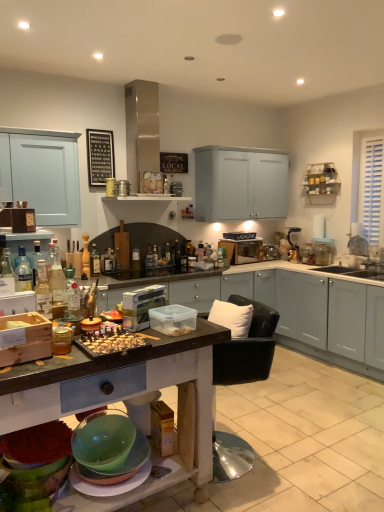
This screenshot has width=384, height=512. What do you see at coordinates (357, 270) in the screenshot? I see `white ceramic sink at right` at bounding box center [357, 270].

Image resolution: width=384 pixels, height=512 pixels. I want to click on white ceramic sink at right, so click(x=357, y=270).

Locate an element on the screen. metallic silver shelves at upper right is located at coordinates (321, 183).

What is the approximate height of white soft cushion at center?

white soft cushion at center is 10.41 inches tall.

This screenshot has height=512, width=384. I want to click on translucent glass bottle at center, which ranks as the 4th bottle in front-to-back order, so click(x=94, y=261).

Where is `clear glass bottle at left, arranged as the 2th bottle when viewed from the left`? clear glass bottle at left, arranged as the 2th bottle when viewed from the left is located at coordinates (36, 260).

Measure the distance between clear glass bottle at left, arranged as the 2th bottle when viewed from the left, and camera.

clear glass bottle at left, arranged as the 2th bottle when viewed from the left, is 7.21 feet from camera.

At what (x,y) coordinates should I click in order to perform the action: click on white plastic toaster at center, acting as the 1th appliance starting from the bottom. Please return your answer as a coordinate pair (x, y). This screenshot has width=384, height=512. Looking at the image, I should click on (141, 306).

How much space does white plastic toaster at center, acting as the 1th appliance starting from the bottom, occupy vertically?

The height of white plastic toaster at center, acting as the 1th appliance starting from the bottom, is 8.03 inches.

Find the location of a particular element. white ceramic sink at right is located at coordinates (357, 270).

From a real-world perspective, does white soft cushion at center sit lower than wooden signboard at upper left?

Yes, from a real-world perspective, white soft cushion at center is below wooden signboard at upper left.

In order to click on pillow directly beneath the wooden signboard at upper left (from a real-world perspective) in this screenshot , I will do `click(232, 317)`.

From a real-world perspective, is translucent glass bottle at center, which is the fifth bottle in left-to-right order, above or below clear glass bottle at center, the fifth bottle when ordered from back to front?

In terms of real-world spatial position, translucent glass bottle at center, which is the fifth bottle in left-to-right order, is below clear glass bottle at center, the fifth bottle when ordered from back to front.

Considering the relative positions of translucent glass bottle at center, which appears as the second bottle when viewed from the right, and clear glass bottle at center, marked as the second bottle in a front-to-back arrangement, in the image provided, is translucent glass bottle at center, which appears as the second bottle when viewed from the right, to the right of clear glass bottle at center, marked as the second bottle in a front-to-back arrangement, from the viewer's perspective?

Yes.

Considering the sizes of objects translucent glass bottle at center, which is the fifth bottle in left-to-right order, and clear glass bottle at center, positioned as the third bottle in right-to-left order, in the image provided, who is bigger, translucent glass bottle at center, which is the fifth bottle in left-to-right order, or clear glass bottle at center, positioned as the third bottle in right-to-left order,?

With larger size is translucent glass bottle at center, which is the fifth bottle in left-to-right order.

Considering the relative positions of translucent glass bottle at center, the 2th bottle from the back, and clear glass bottle at center, which ranks as the 4th bottle in left-to-right order, in the image provided, is translucent glass bottle at center, the 2th bottle from the back, in front of clear glass bottle at center, which ranks as the 4th bottle in left-to-right order,?

No, translucent glass bottle at center, the 2th bottle from the back, is further to the viewer.

Choose the correct answer: Is translucent glass bottle at center, the 1th bottle viewed from the right, inside clear glass bottle at center, marked as the second bottle in a front-to-back arrangement, or outside it?

The correct answer is: outside.

Who is taller, translucent glass bottle at center, placed as the 1th bottle when sorted from back to front, or clear glass bottle at center, positioned as the third bottle in right-to-left order?

With more height is translucent glass bottle at center, placed as the 1th bottle when sorted from back to front.

From a real-world perspective, which object rests below the other?

translucent glass bottle at center, which appears as the 6th bottle when viewed from the front, from a real-world perspective.

Measure the distance between translucent glass bottle at center, which appears as the 6th bottle when viewed from the front, and clear glass bottle at center, positioned as the third bottle in right-to-left order.

translucent glass bottle at center, which appears as the 6th bottle when viewed from the front, and clear glass bottle at center, positioned as the third bottle in right-to-left order, are 2.24 meters apart.

From the image's perspective, count 1st bottles downward from the translucent glass bottle at center, arranged as the 6th bottle when viewed from the right, and point to it. Please provide its 2D coordinates.

[(36, 260)]

Which point is more forward, (x=96, y=251) or (x=34, y=271)?

The point (x=34, y=271) is in front.

Is translucent glass bottle at center, placed as the 3th bottle when sorted from back to front, taller or shorter than clear glass bottle at left, positioned as the 3th bottle in front-to-back order?

Considering their sizes, translucent glass bottle at center, placed as the 3th bottle when sorted from back to front, has more height than clear glass bottle at left, positioned as the 3th bottle in front-to-back order.

Is clear glass bottle at left, positioned as the 3th bottle in front-to-back order, not within metallic silver shelves at upper right?

Indeed, clear glass bottle at left, positioned as the 3th bottle in front-to-back order, is completely outside metallic silver shelves at upper right.

Between clear glass bottle at left, the 5th bottle from the right, and metallic silver shelves at upper right, which one has more height?

metallic silver shelves at upper right.

Between clear glass bottle at left, the 5th bottle from the right, and metallic silver shelves at upper right, which one has smaller size?

clear glass bottle at left, the 5th bottle from the right.

Consider the image. How many degrees apart are the facing directions of clear glass bottle at left, the 5th bottle from the right, and metallic silver shelves at upper right?

The angular difference between clear glass bottle at left, the 5th bottle from the right, and metallic silver shelves at upper right is 180 degrees.

Consider the image. Is clear glass bottle at left, which ranks as the fourth bottle in back-to-front order, next to wooden signboard at upper left and touching it?

No, clear glass bottle at left, which ranks as the fourth bottle in back-to-front order, is not in contact with wooden signboard at upper left.

From a real-world perspective, which object rests below the other?

In real-world perspective, clear glass bottle at left, arranged as the 2th bottle when viewed from the left, is lower.

Is clear glass bottle at left, the 5th bottle from the right, completely or partially outside of wooden signboard at upper left?

Yes.

Find the location of `the 2nd bottle in front of the wooden signboard at upper left`. the 2nd bottle in front of the wooden signboard at upper left is located at coordinates (36, 260).

How far apart are translucent glass bottle at center, marked as the first bottle in a left-to-right arrangement, and metallic silver shelves at upper right?

The distance of translucent glass bottle at center, marked as the first bottle in a left-to-right arrangement, from metallic silver shelves at upper right is 8.47 feet.

From the image's perspective, which is below, translucent glass bottle at center, which ranks as the 4th bottle in front-to-back order, or metallic silver shelves at upper right?

translucent glass bottle at center, which ranks as the 4th bottle in front-to-back order.

Can you confirm if translucent glass bottle at center, marked as the first bottle in a left-to-right arrangement, is thinner than metallic silver shelves at upper right?

Yes, translucent glass bottle at center, marked as the first bottle in a left-to-right arrangement, is thinner than metallic silver shelves at upper right.

Considering the points (90, 267) and (332, 185), which point is behind, point (90, 267) or point (332, 185)?

The point (332, 185) is farther.

Find the location of a particular element. The image size is (384, 512). bulletin board on the left of white soft cushion at center is located at coordinates (100, 156).

In order to click on the 3rd bottle in front of the translucent glass bottle at center, which is the fifth bottle in left-to-right order in this screenshot , I will do `click(71, 294)`.

Which object lies nearer to the anchor point metallic silver blender at upper right, arranged as the second appliance when ordered from the bottom, translucent glass bottle at center, placed as the 3th bottle when sorted from back to front, or clear glass bottle at center, positioned as the third bottle in right-to-left order?

translucent glass bottle at center, placed as the 3th bottle when sorted from back to front, is positioned closer to the anchor metallic silver blender at upper right, arranged as the second appliance when ordered from the bottom.

Considering their positions, is metallic silver shelves at upper right positioned further to translucent glass bottle at center, which ranks as the 4th bottle in front-to-back order, than white soft cushion at center?

metallic silver shelves at upper right is positioned further to the anchor translucent glass bottle at center, which ranks as the 4th bottle in front-to-back order.

Looking at the image, which one is located further to black leather chair at center, white plastic toaster at center, which ranks as the second appliance in left-to-right order, or metallic canister at center, arranged as the 2th appliance when viewed from the front?

Based on the image, metallic canister at center, arranged as the 2th appliance when viewed from the front, appears to be further to black leather chair at center.

Which object lies nearer to the anchor point white soft cushion at center, clear glass bottle at center, which ranks as the 4th bottle in left-to-right order, or metallic silver blender at upper right, arranged as the second appliance when ordered from the bottom?

clear glass bottle at center, which ranks as the 4th bottle in left-to-right order, lies closer to white soft cushion at center than the other object.

When comparing their distances from metallic silver shelves at upper right, does metallic silver blender at upper right, the first appliance from the back, or white plastic toaster at center, which is the first appliance in front-to-back order, seem closer?

metallic silver blender at upper right, the first appliance from the back, is closer to metallic silver shelves at upper right.

Based on their spatial positions, is black leather chair at center or white plastic toaster at center, the 3th appliance in the back-to-front sequence, further from clear glass bottle at center, which ranks as the 4th bottle in left-to-right order?

black leather chair at center is positioned further to the anchor clear glass bottle at center, which ranks as the 4th bottle in left-to-right order.

Based on their spatial positions, is metallic canister at center, arranged as the first appliance when viewed from the top, or black leather chair at center closer to metallic silver shelves at upper right?

metallic canister at center, arranged as the first appliance when viewed from the top.

Based on their spatial positions, is translucent glass bottle at center, which ranks as the 4th bottle in front-to-back order, or wooden signboard at upper left further from clear glass bottle at center, marked as the second bottle in a front-to-back arrangement?

wooden signboard at upper left lies further to clear glass bottle at center, marked as the second bottle in a front-to-back arrangement, than the other object.

Image resolution: width=384 pixels, height=512 pixels. I want to click on pillow positioned between clear glass bottle at left, which ranks as the fourth bottle in back-to-front order, and metallic silver shelves at upper right from near to far, so click(x=232, y=317).

Where is `chair located between translucent glass bottle at left, acting as the 6th bottle starting from the back, and metallic silver blender at upper right, the 2th appliance in the top-to-bottom sequence, in the depth direction`? chair located between translucent glass bottle at left, acting as the 6th bottle starting from the back, and metallic silver blender at upper right, the 2th appliance in the top-to-bottom sequence, in the depth direction is located at coordinates (247, 348).

Image resolution: width=384 pixels, height=512 pixels. What are the coordinates of `bottle situated between translucent glass bottle at center, the 5th bottle in the front-to-back sequence, and metallic silver blender at upper right, the 2th appliance in the top-to-bottom sequence, from left to right` in the screenshot? It's located at click(x=177, y=254).

At what (x,y) coordinates should I click in order to perform the action: click on appliance located between translucent glass bottle at center, placed as the 1th bottle when sorted from back to front, and white ceramic sink at right in the left-right direction. Please return your answer as a coordinate pair (x, y). Image resolution: width=384 pixels, height=512 pixels. Looking at the image, I should click on (293, 245).